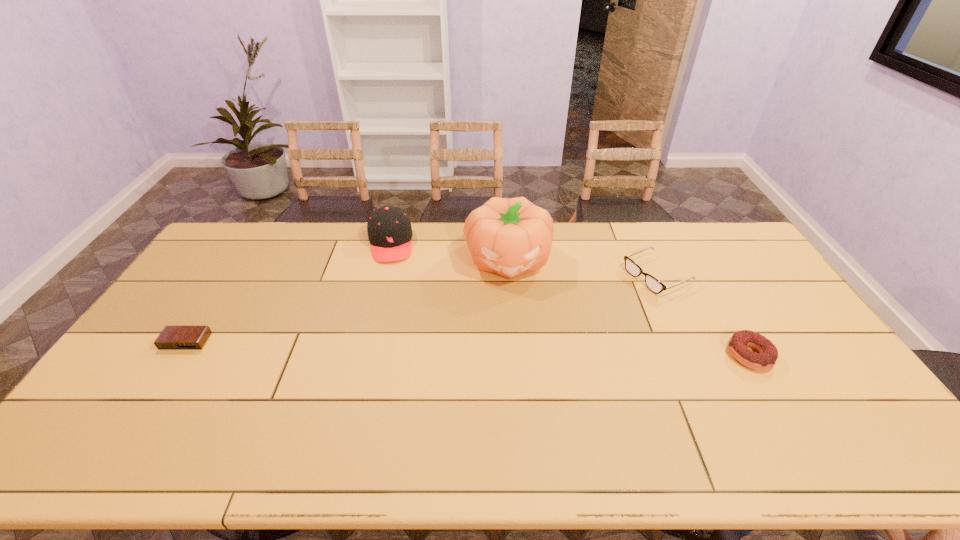
What are the coordinates of `free space on the desktop that is between the leftmost object and the doughnut and is positioned on the carved face of the third object from left to right` in the screenshot? It's located at (516, 349).

This screenshot has width=960, height=540. Identify the location of free space on the desktop that is between the shortest object and the doughnut and is positioned on the front-facing side of the spectacles. (488, 349).

The height and width of the screenshot is (540, 960). Find the location of `vacant space on the desktop that is between the shortest object and the doughnut and is positioned on the front-facing side of the second tallest object`. vacant space on the desktop that is between the shortest object and the doughnut and is positioned on the front-facing side of the second tallest object is located at coordinates (397, 346).